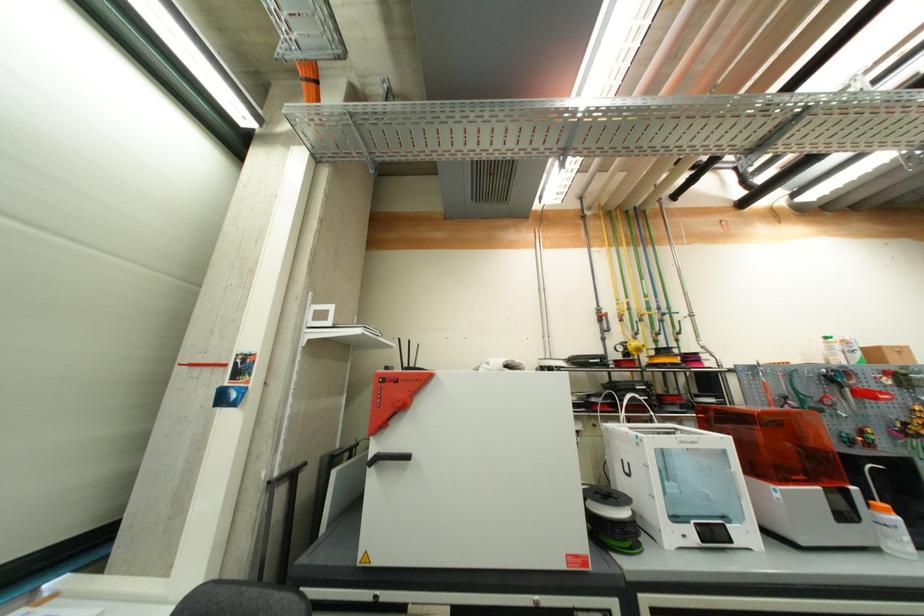
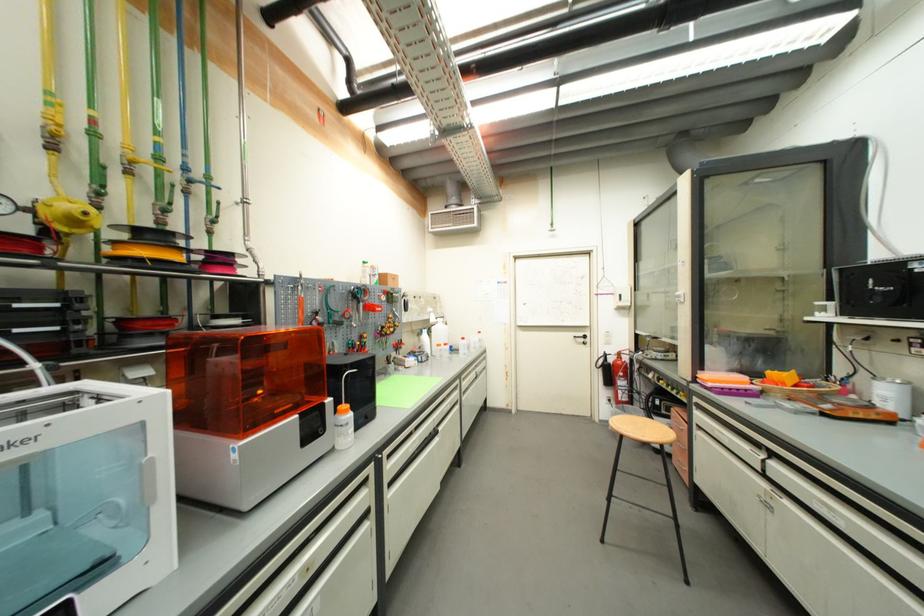
Where in the second image is the point corresponding to (x=794, y=373) from the first image?

(334, 289)